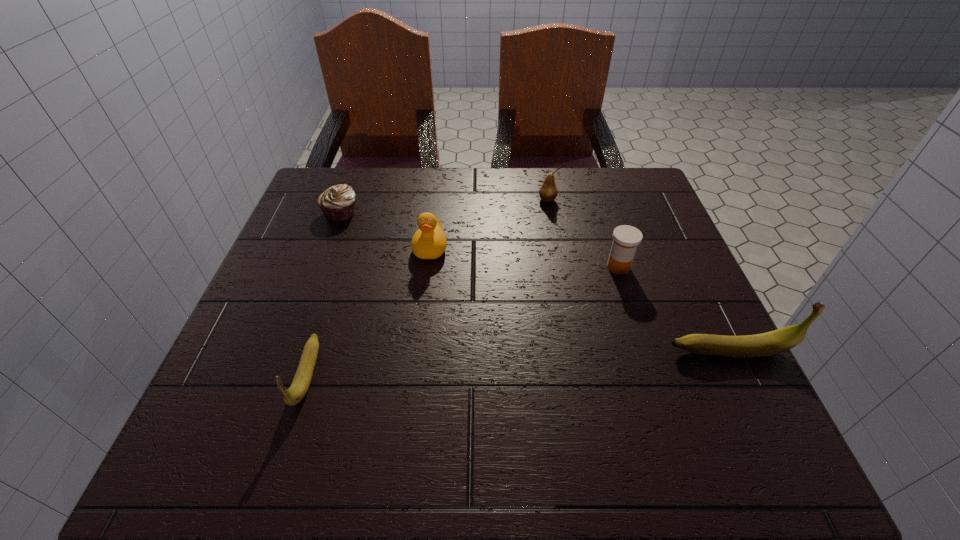
Identify the location of the shorter banana. Image resolution: width=960 pixels, height=540 pixels. (300, 384).

Locate an element on the screen. The width and height of the screenshot is (960, 540). the tallest object is located at coordinates (774, 342).

You are a GUI agent. You are given a task and a screenshot of the screen. Output one action in this format:
    pyautogui.click(x=<x>, y=<y>)
    Task: Click on the taller banana
    The image size is (960, 540).
    Given the screenshot: What is the action you would take?
    pyautogui.click(x=774, y=342)

Where is `pear`? Image resolution: width=960 pixels, height=540 pixels. pear is located at coordinates (x=548, y=191).

The width and height of the screenshot is (960, 540). Identify the location of the shortest object. (337, 203).

Locate an element on the screen. medicine is located at coordinates (626, 238).

Image resolution: width=960 pixels, height=540 pixels. Find the location of `duck`. duck is located at coordinates (429, 242).

At what (x,y) coordinates should I click in order to perform the action: click on vacant position located 0.230m on the front of the third object from right to left. Please return your answer as a coordinate pair (x, y). Looking at the image, I should click on (560, 267).

The height and width of the screenshot is (540, 960). I want to click on vacant area situated 0.170m on the right of the muffin, so click(426, 213).

I want to click on blank space located on the label of the medicine, so click(423, 267).